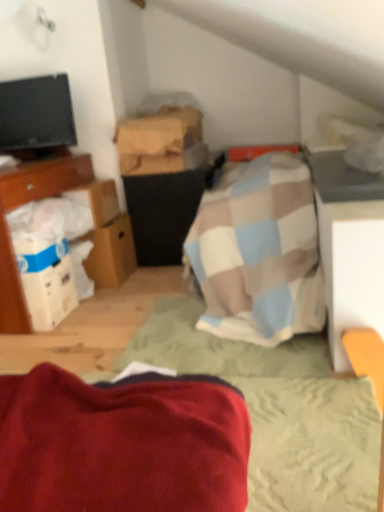
Question: Looking at their shapes, would you say white cardboard boxes at left is wider or thinner than wooden bed frame at center?

Choices:
 (A) wide
 (B) thin

Answer: (B)

Question: Would you say white cardboard boxes at left is to the left or to the right of wooden bed frame at center in the picture?

Choices:
 (A) left
 (B) right

Answer: (A)

Question: Which object is the farthest from the brown cardboard box at upper center, marked as the third cardboard box in a bottom-to-top arrangement?

Choices:
 (A) black matte vanity at center
 (B) white cardboard boxes at left
 (C) velvety red blanket at lower left
 (D) white cardboard box at center-left, positioned as the 3th cardboard box in top-to-bottom order
 (E) brown cardboard box at left, which is counted as the 2th cardboard box, starting from the bottom

Answer: (C)

Question: Estimate the real-world distances between objects in this image. Which object is closer to the white cardboard box at center-left, which is counted as the 1th cardboard box, starting from the bottom?

Choices:
 (A) brown cardboard box at upper center, the first cardboard box viewed from the top
 (B) white cardboard boxes at left
 (C) wooden bed frame at center
 (D) brown cardboard box at left, which is counted as the 2th cardboard box, starting from the bottom
 (E) velvety red blanket at lower left

Answer: (D)